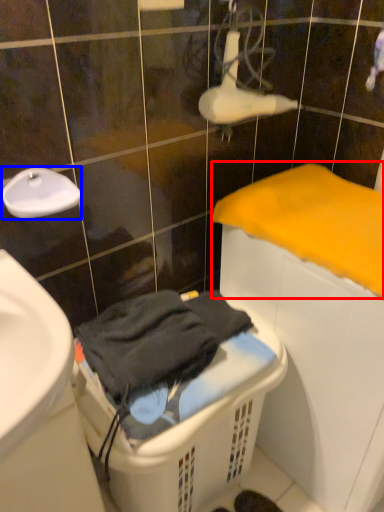
Question: Which point is closer to the camera, bath towel (highlighted by a red box) or faucet (highlighted by a blue box)?

Choices:
 (A) bath towel
 (B) faucet

Answer: (A)